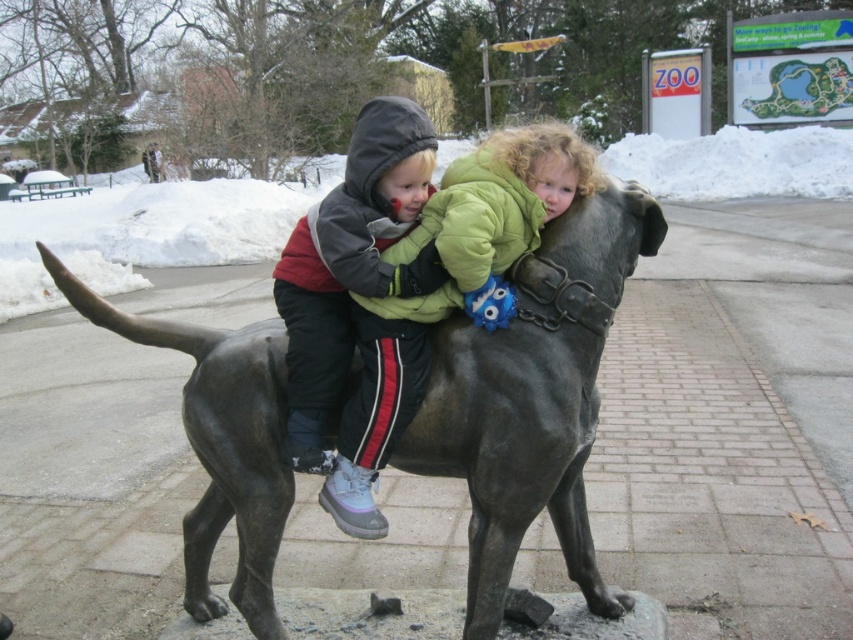
Question: Which of the following is the farthest from the observer?

Choices:
 (A) green fleece jacket at center
 (B) bronze statue at center

Answer: (A)

Question: Does bronze statue at center appear on the right side of green fleece jacket at center?

Choices:
 (A) no
 (B) yes

Answer: (A)

Question: Which object is positioned closest to the green fleece jacket at center?

Choices:
 (A) white fluffy snow at upper center
 (B) bronze statue at center

Answer: (B)

Question: Does green fleece jacket at center have a greater width compared to matte black jacket at center?

Choices:
 (A) yes
 (B) no

Answer: (A)

Question: Considering the real-world distances, which object is closest to the bronze statue at center?

Choices:
 (A) white fluffy snow at upper center
 (B) matte black jacket at center

Answer: (B)

Question: Is green fleece jacket at center behind matte black jacket at center?

Choices:
 (A) yes
 (B) no

Answer: (B)